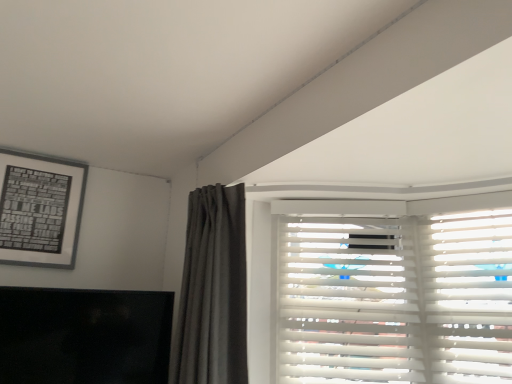
Question: Is white wood blinds at upper right bigger than black matte tv at lower left?

Choices:
 (A) yes
 (B) no

Answer: (A)

Question: Considering the relative sizes of white wood blinds at upper right and black matte tv at lower left in the image provided, is white wood blinds at upper right shorter than black matte tv at lower left?

Choices:
 (A) no
 (B) yes

Answer: (A)

Question: Is white wood blinds at upper right looking in the opposite direction of black matte tv at lower left?

Choices:
 (A) yes
 (B) no

Answer: (B)

Question: Is white wood blinds at upper right with black matte tv at lower left?

Choices:
 (A) no
 (B) yes

Answer: (A)

Question: From a real-world perspective, is white wood blinds at upper right beneath black matte tv at lower left?

Choices:
 (A) yes
 (B) no

Answer: (B)

Question: Is black matte picture frame at upper left taller or shorter than black matte tv at lower left?

Choices:
 (A) short
 (B) tall

Answer: (B)

Question: From a real-world perspective, is black matte picture frame at upper left above or below black matte tv at lower left?

Choices:
 (A) above
 (B) below

Answer: (A)

Question: From the image's perspective, relative to black matte tv at lower left, is black matte picture frame at upper left above or below?

Choices:
 (A) below
 (B) above

Answer: (B)

Question: Does point (66, 188) appear closer or farther from the camera than point (5, 367)?

Choices:
 (A) farther
 (B) closer

Answer: (A)

Question: From their relative heights in the image, would you say white wood blinds at upper right is taller or shorter than black matte tv at lower left?

Choices:
 (A) short
 (B) tall

Answer: (B)

Question: Is point (385, 342) positioned closer to the camera than point (103, 370)?

Choices:
 (A) closer
 (B) farther

Answer: (B)

Question: Is white wood blinds at upper right to the left or to the right of black matte tv at lower left in the image?

Choices:
 (A) left
 (B) right

Answer: (B)

Question: From the image's perspective, relative to black matte tv at lower left, is white wood blinds at upper right above or below?

Choices:
 (A) below
 (B) above

Answer: (B)

Question: In terms of width, does black matte tv at lower left look wider or thinner when compared to black matte picture frame at upper left?

Choices:
 (A) wide
 (B) thin

Answer: (A)

Question: Is black matte tv at lower left taller or shorter than black matte picture frame at upper left?

Choices:
 (A) tall
 (B) short

Answer: (B)